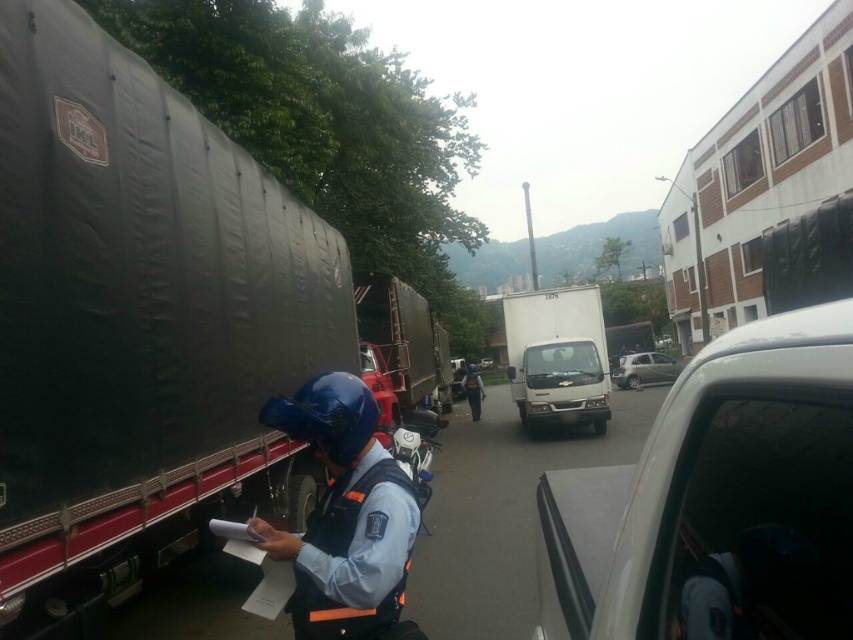
Question: Which point appears closest to the camera in this image?

Choices:
 (A) (383, 513)
 (B) (596, 324)

Answer: (A)

Question: Which point is closer to the camera taking this photo?

Choices:
 (A) (312, 410)
 (B) (479, 401)
 (C) (100, 316)
 (D) (657, 380)

Answer: (A)

Question: Can you confirm if white matte truck at center is positioned to the right of dark blue uniform at center?

Choices:
 (A) yes
 (B) no

Answer: (A)

Question: Is dark matte trailer truck at left to the right of dark blue uniform at center from the viewer's perspective?

Choices:
 (A) yes
 (B) no

Answer: (B)

Question: Does white matte truck at center appear over dark blue uniform at center?

Choices:
 (A) no
 (B) yes

Answer: (B)

Question: Which point is farther to the camera?

Choices:
 (A) dark blue uniform at center
 (B) white glossy car at center
 (C) dark matte trailer truck at left
 (D) silver metallic car at center

Answer: (D)